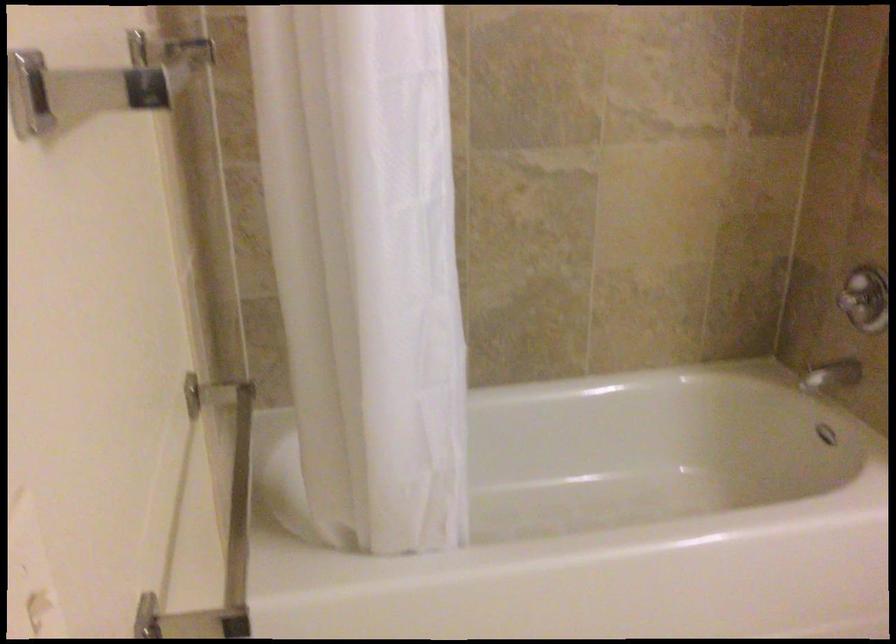
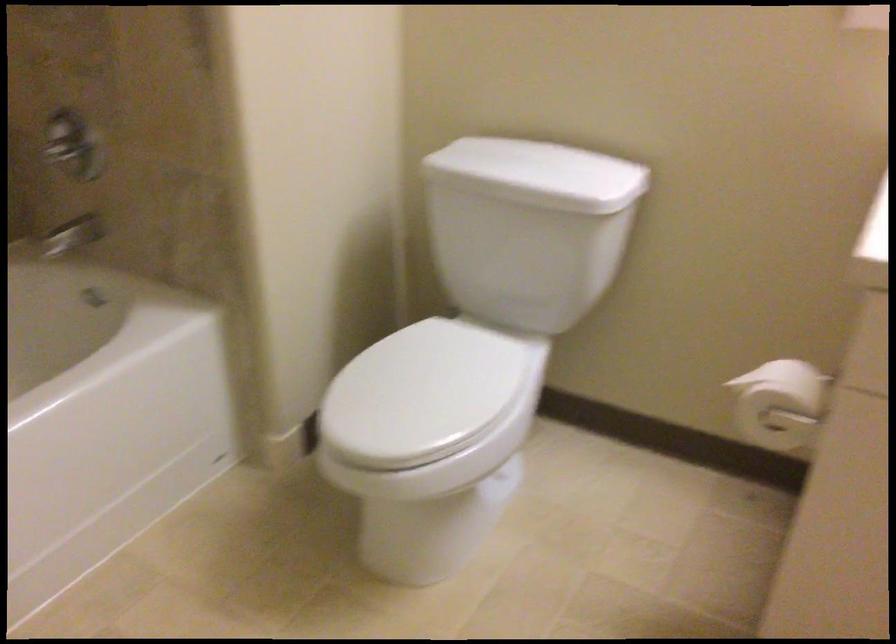
Question: How did the camera likely rotate?

Choices:
 (A) Left
 (B) Right
 (C) Up
 (D) Down

Answer: (B)